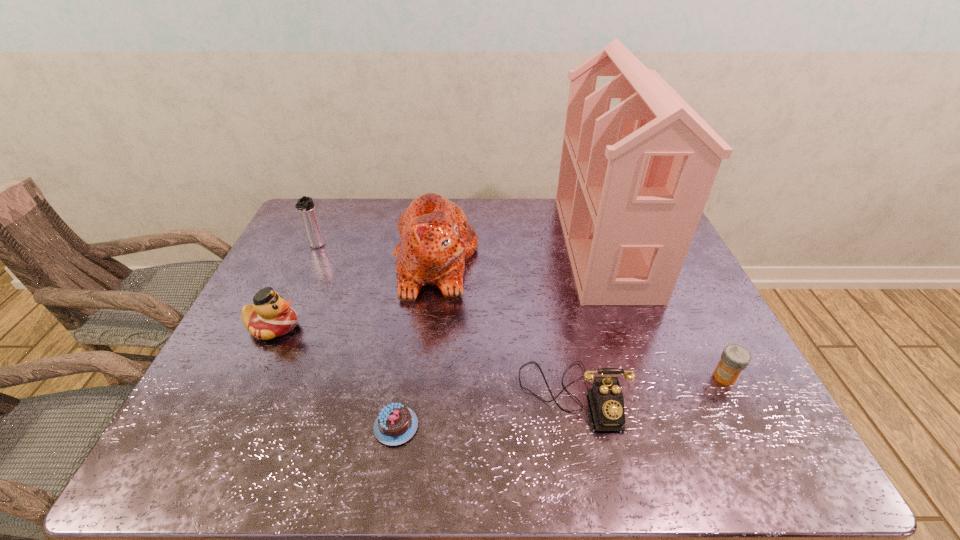
At what (x,y) coordinates should I click in order to perform the action: click on dollhouse. Please return your answer as a coordinate pair (x, y). The height and width of the screenshot is (540, 960). Looking at the image, I should click on click(633, 182).

Locate an element on the screen. The image size is (960, 540). the sixth shortest object is located at coordinates 436,239.

Where is `the fifth shortest object`? The width and height of the screenshot is (960, 540). the fifth shortest object is located at coordinates pos(305,205).

Where is `the fourth tallest object`? The height and width of the screenshot is (540, 960). the fourth tallest object is located at coordinates (270, 316).

Where is `duck`? This screenshot has height=540, width=960. duck is located at coordinates (270, 316).

At what (x,y) coordinates should I click in order to perform the action: click on telephone. Please return your answer as a coordinate pair (x, y). The width and height of the screenshot is (960, 540). Looking at the image, I should click on (606, 398).

Find the location of `the sixth tallest object`. the sixth tallest object is located at coordinates (734, 359).

Find the location of a particular element. This screenshot has height=540, width=960. medicine is located at coordinates (734, 359).

You are a GUI agent. You are given a task and a screenshot of the screen. Output one action in this format:
    pyautogui.click(x=<x>, y=<y>)
    Task: Click on the shortest object
    The image size is (960, 540).
    Given the screenshot: What is the action you would take?
    pyautogui.click(x=396, y=424)

I want to click on free spot located on the front-facing side of the tallest object, so click(x=523, y=246).